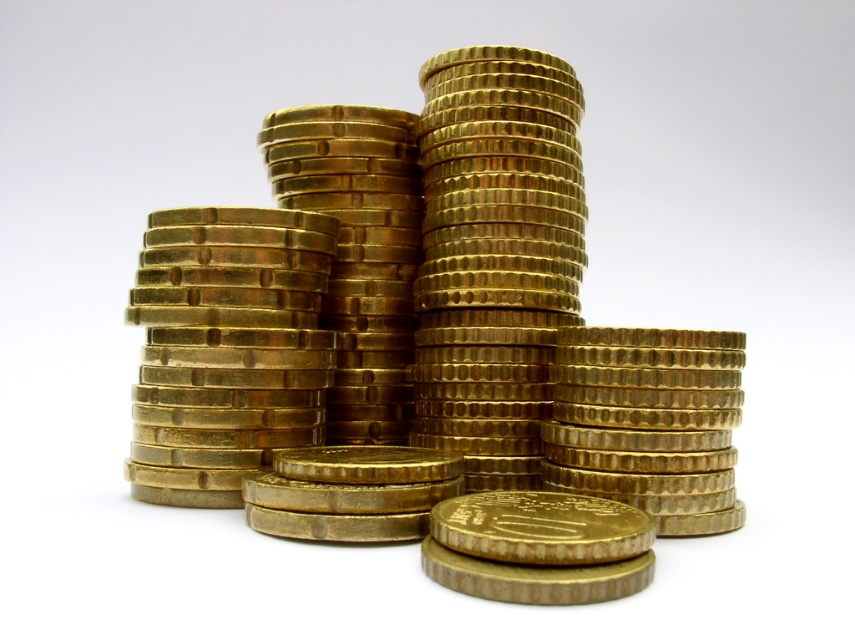
Who is shorter, gold shiny coins at center or gold metallic coin at center?

gold metallic coin at center is shorter.

Who is lower down, gold shiny coins at center or gold metallic coin at center?

gold metallic coin at center

Who is more forward, (553,497) or (546,540)?

Point (546,540)

Identify the location of gold shiny coins at center. (422, 339).